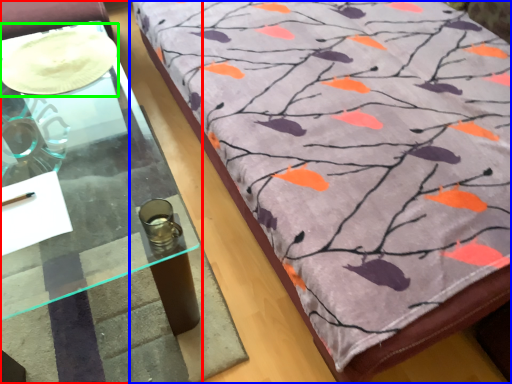
Question: Which object is the farthest from table (highlighted by a red box)? Choose among these: furniture (highlighted by a blue box) or glass plate (highlighted by a green box).

Choices:
 (A) furniture
 (B) glass plate

Answer: (A)